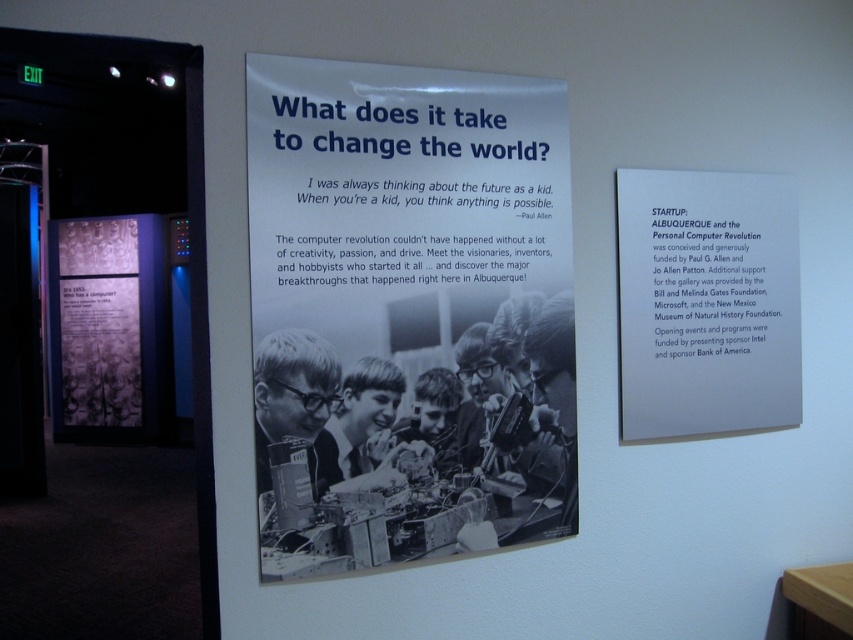
Question: Is the position of black paper poster at center more distant than that of white paper at upper right?

Choices:
 (A) no
 (B) yes

Answer: (A)

Question: Is black paper poster at center bigger than translucent purple text at center?

Choices:
 (A) no
 (B) yes

Answer: (A)

Question: Estimate the real-world distances between objects in this image. Which object is closer to the white paper at upper right?

Choices:
 (A) black paper poster at center
 (B) translucent purple text at center

Answer: (A)

Question: Considering the real-world distances, which object is closest to the black paper poster at center?

Choices:
 (A) white paper at upper right
 (B) translucent purple text at center

Answer: (A)

Question: Which of these objects is positioned closest to the translucent purple text at center?

Choices:
 (A) white paper at upper right
 (B) black paper poster at center

Answer: (B)

Question: Does black paper poster at center have a larger size compared to white paper at upper right?

Choices:
 (A) yes
 (B) no

Answer: (A)